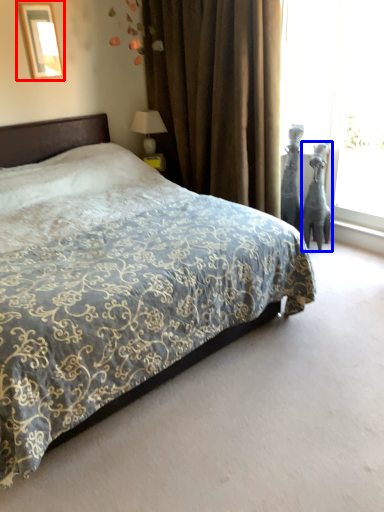
Question: Which point is further to the camera, picture frame (highlighted by a red box) or animal (highlighted by a blue box)?

Choices:
 (A) picture frame
 (B) animal

Answer: (B)